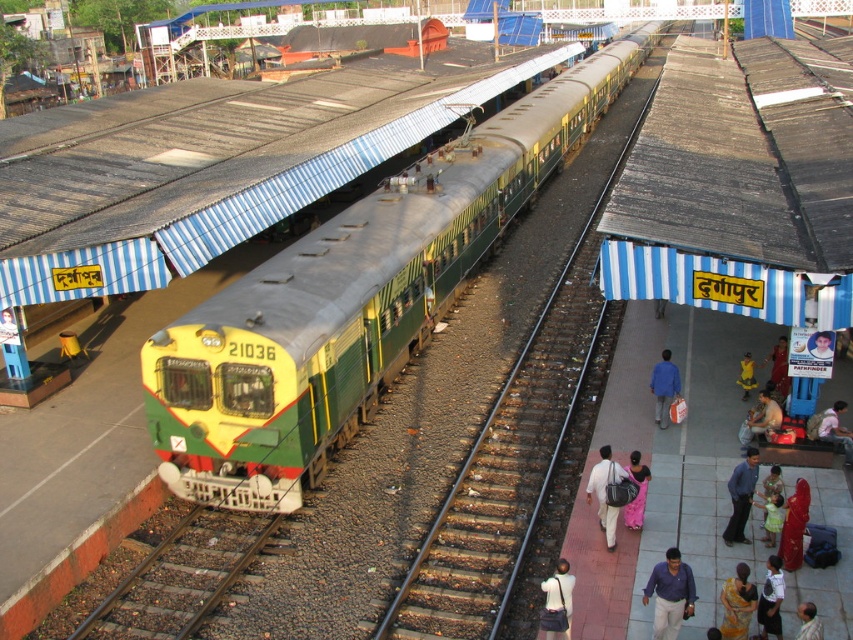
Based on the photo, you are a photographer standing on the platform at the railway station. You want to capture both the blue cotton shirt at lower right and the light brown fabric shirt at center in a single photo. Which shirt should you zoom in on to ensure both are visible without cropping?

You should zoom in on the light brown fabric shirt at center because the blue cotton shirt at lower right is narrower than the light brown fabric shirt at center, so focusing on the wider one allows both to fit within the frame.

You are a passenger waiting on the platform at the railway station. You notice a green matte train at center and a light blue fabric shirt at center. Which object is closer to you?

The green matte train at center is positioned over the light blue fabric shirt at center, meaning it is closer to you.

Looking at this image, you are a traveler standing on the platform and want to place your matte black bag at center into a storage compartment that can only fit items narrower than your light blue fabric shirt at center. Based on the scene, can your bag fit?

The matte black bag at center is narrower than the light blue fabric shirt at center, so it should fit in the storage compartment.